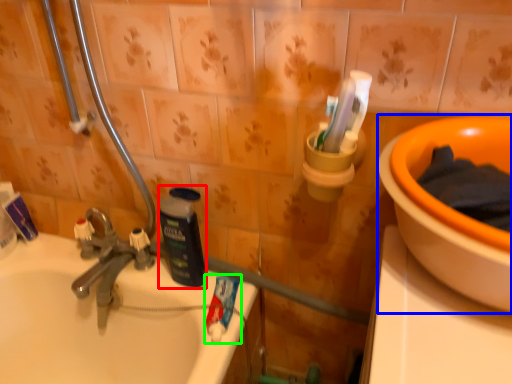
Question: Based on their relative distances, which object is farther from bottle (highlighted by a red box)? Choose from basin (highlighted by a blue box) and toothpaste (highlighted by a green box).

Choices:
 (A) basin
 (B) toothpaste

Answer: (A)